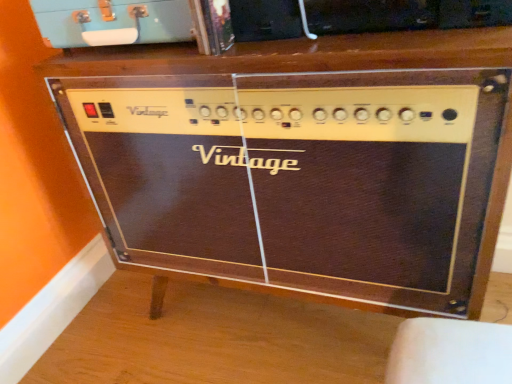
The image size is (512, 384). Describe the element at coordinates (302, 163) in the screenshot. I see `brown fabric amplifier at center` at that location.

Measure the distance between point (92, 51) and camera.

Point (92, 51) and camera are 31.38 inches apart.

This screenshot has height=384, width=512. What are the coordinates of `brown fabric amplifier at center` in the screenshot? It's located at (302, 163).

In order to face brown fabric amplifier at center, should I rotate leftwards or rightwards?

You should rotate right by 3.273 degrees.

Image resolution: width=512 pixels, height=384 pixels. Find the location of `brown fabric amplifier at center`. brown fabric amplifier at center is located at coordinates (302, 163).